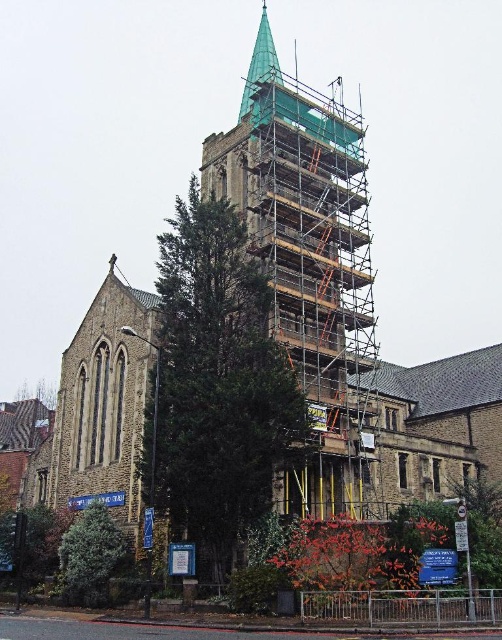
Does green textured tree at center have a greater height compared to green glass spire at upper center?

In fact, green textured tree at center may be shorter than green glass spire at upper center.

Who is more distant from viewer, (231, 520) or (264, 36)?

Positioned behind is point (264, 36).

Find the location of a particular element. This screenshot has width=502, height=640. green textured tree at center is located at coordinates (217, 381).

In the scene shown: Can you confirm if green textured tree at center is thinner than green textured tree at lower left?

In fact, green textured tree at center might be wider than green textured tree at lower left.

Can you confirm if green textured tree at center is positioned above green textured tree at lower left?

Yes.

Find the location of a particular element. Image resolution: width=502 pixels, height=640 pixels. green textured tree at center is located at coordinates (217, 381).

Find the location of `green textured tree at center`. green textured tree at center is located at coordinates (217, 381).

Between green metal scaffolding at center and green glass spire at upper center, which one appears on the right side from the viewer's perspective?

From the viewer's perspective, green metal scaffolding at center appears more on the right side.

Who is positioned more to the left, green metal scaffolding at center or green glass spire at upper center?

green glass spire at upper center is more to the left.

Is point (293, 493) in front of point (258, 52)?

Yes, it is.

Locate an element on the screen. green metal scaffolding at center is located at coordinates [309, 266].